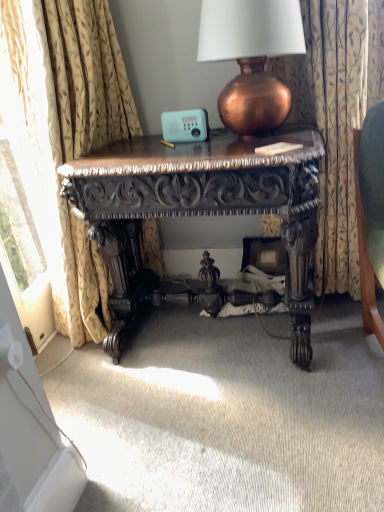
Question: Is polished dark wood desk at center not near floral fabric curtain at right, the 2th curtain in the left-to-right sequence?

Choices:
 (A) no
 (B) yes

Answer: (A)

Question: Does polished dark wood desk at center have a lesser width compared to floral fabric curtain at right, which is the first curtain from right to left?

Choices:
 (A) no
 (B) yes

Answer: (A)

Question: Is polished dark wood desk at center positioned with its back to floral fabric curtain at right, which is the first curtain from right to left?

Choices:
 (A) yes
 (B) no

Answer: (B)

Question: Is polished dark wood desk at center not inside floral fabric curtain at right, the 2th curtain in the left-to-right sequence?

Choices:
 (A) no
 (B) yes

Answer: (B)

Question: From a real-world perspective, is polished dark wood desk at center physically below floral fabric curtain at right, the 2th curtain in the left-to-right sequence?

Choices:
 (A) yes
 (B) no

Answer: (A)

Question: Based on their sizes in the image, would you say floral fabric curtain at right, which is the first curtain from right to left, is bigger or smaller than copper metallic lamp at upper center?

Choices:
 (A) big
 (B) small

Answer: (A)

Question: Is floral fabric curtain at right, which is the first curtain from right to left, wider or thinner than copper metallic lamp at upper center?

Choices:
 (A) wide
 (B) thin

Answer: (B)

Question: From their relative heights in the image, would you say floral fabric curtain at right, the 2th curtain in the left-to-right sequence, is taller or shorter than copper metallic lamp at upper center?

Choices:
 (A) short
 (B) tall

Answer: (B)

Question: Is floral fabric curtain at right, which is the first curtain from right to left, situated inside copper metallic lamp at upper center or outside?

Choices:
 (A) outside
 (B) inside

Answer: (A)

Question: Is copper metallic lamp at upper center taller or shorter than floral fabric curtain at right, which is the first curtain from right to left?

Choices:
 (A) short
 (B) tall

Answer: (A)

Question: Considering the relative positions of copper metallic lamp at upper center and floral fabric curtain at right, the 2th curtain in the left-to-right sequence, in the image provided, is copper metallic lamp at upper center to the left or to the right of floral fabric curtain at right, the 2th curtain in the left-to-right sequence,?

Choices:
 (A) left
 (B) right

Answer: (A)

Question: Is copper metallic lamp at upper center bigger or smaller than floral fabric curtain at right, which is the first curtain from right to left?

Choices:
 (A) big
 (B) small

Answer: (B)

Question: In terms of width, does copper metallic lamp at upper center look wider or thinner when compared to floral fabric curtain at right, the 2th curtain in the left-to-right sequence?

Choices:
 (A) wide
 (B) thin

Answer: (A)

Question: Considering the positions of gold floral fabric curtain at left, the 2th curtain from the right, and polished dark wood desk at center in the image, is gold floral fabric curtain at left, the 2th curtain from the right, taller or shorter than polished dark wood desk at center?

Choices:
 (A) tall
 (B) short

Answer: (A)

Question: From the image's perspective, is gold floral fabric curtain at left, which is the first curtain in left-to-right order, above or below polished dark wood desk at center?

Choices:
 (A) below
 (B) above

Answer: (B)